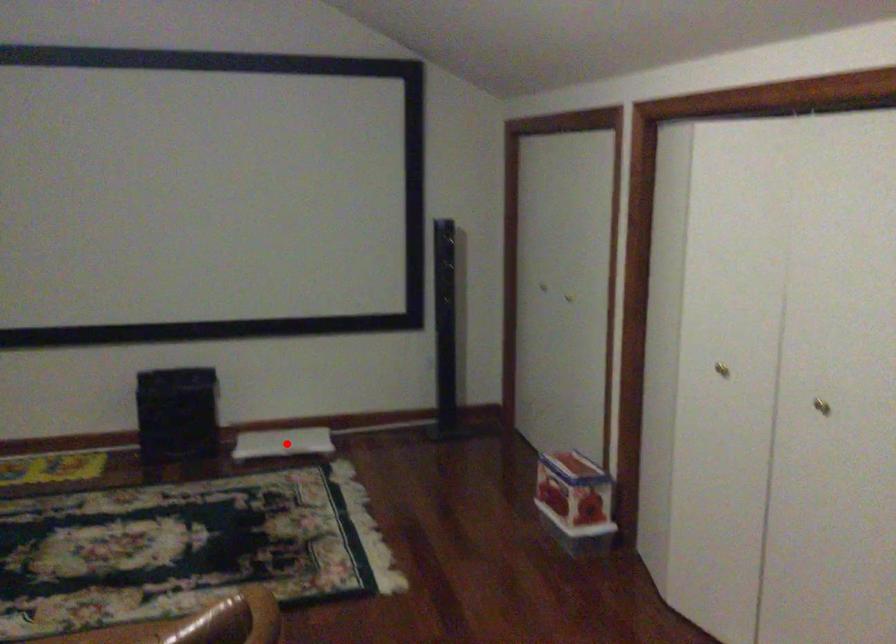
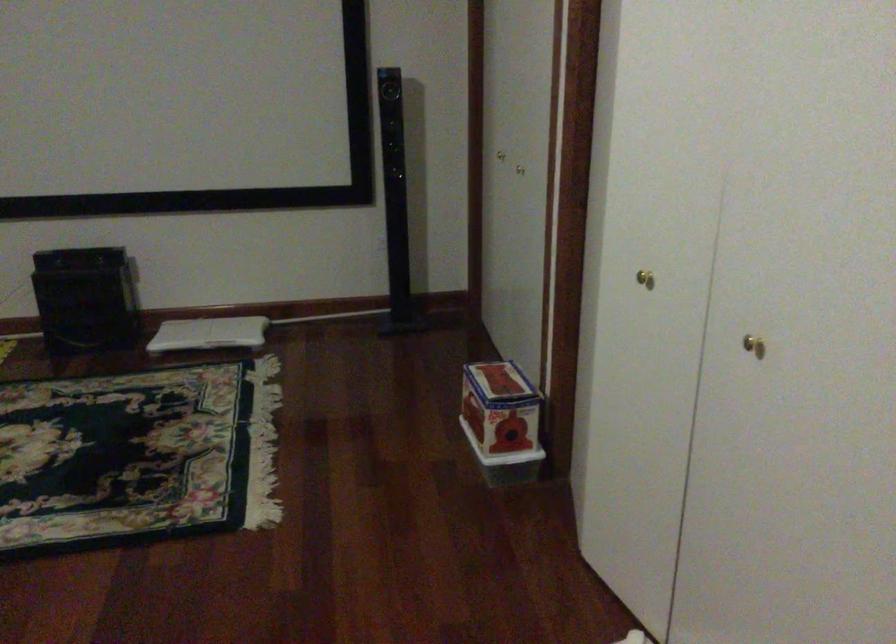
The point at the highlighted location is marked in the first image. Where is the corresponding point in the second image?

(209, 333)